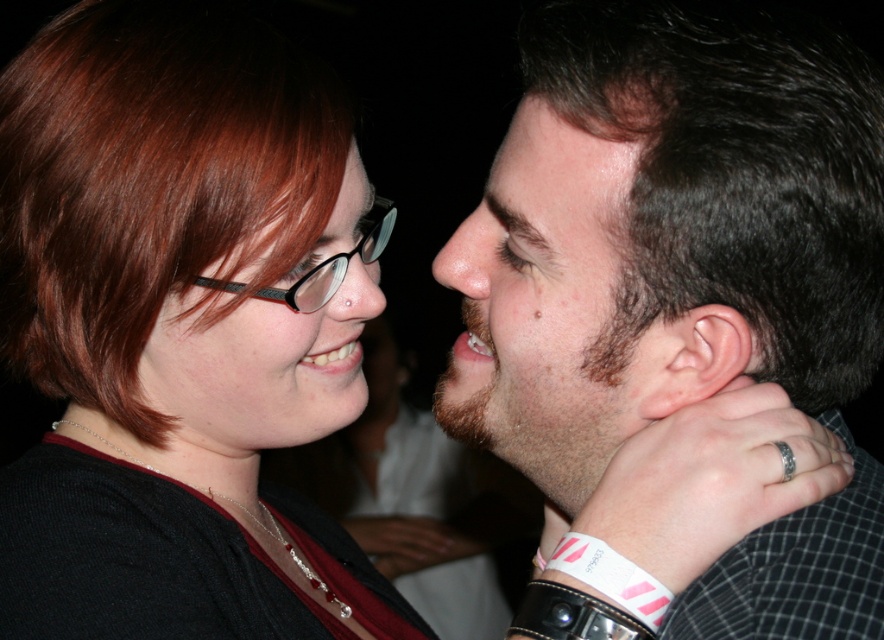
Does brownsmoothhair at left have a greater height compared to brown hair at right?

Correct, brownsmoothhair at left is much taller as brown hair at right.

Is the position of brownsmoothhair at left less distant than that of brown hair at right?

No, it is not.

The height and width of the screenshot is (640, 884). What do you see at coordinates (151, 184) in the screenshot? I see `brownsmoothhair at left` at bounding box center [151, 184].

This screenshot has height=640, width=884. I want to click on brownsmoothhair at left, so [151, 184].

Between brown hair at right and matte black glasses at upper left, which one is positioned lower?

matte black glasses at upper left is below.

Who is more forward, (471, 336) or (355, 164)?

Positioned in front is point (471, 336).

Find the location of a particular element. brown hair at right is located at coordinates (539, 294).

This screenshot has height=640, width=884. What are the coordinates of `brown hair at right` in the screenshot? It's located at (539, 294).

Can you confirm if brownsmoothhair at left is bigger than matte black glasses at upper left?

Correct, brownsmoothhair at left is larger in size than matte black glasses at upper left.

Between brownsmoothhair at left and matte black glasses at upper left, which one is positioned higher?

brownsmoothhair at left is higher up.

Between point (109, 202) and point (185, 397), which one is positioned behind?

The point (185, 397) is behind.

This screenshot has width=884, height=640. I want to click on brownsmoothhair at left, so [x=151, y=184].